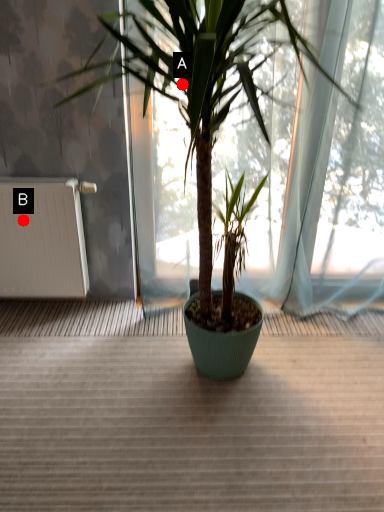
Question: Two points are circled on the image, labeled by A and B beside each circle. Which point is closer to the camera taking this photo?

Choices:
 (A) A is closer
 (B) B is closer

Answer: (A)